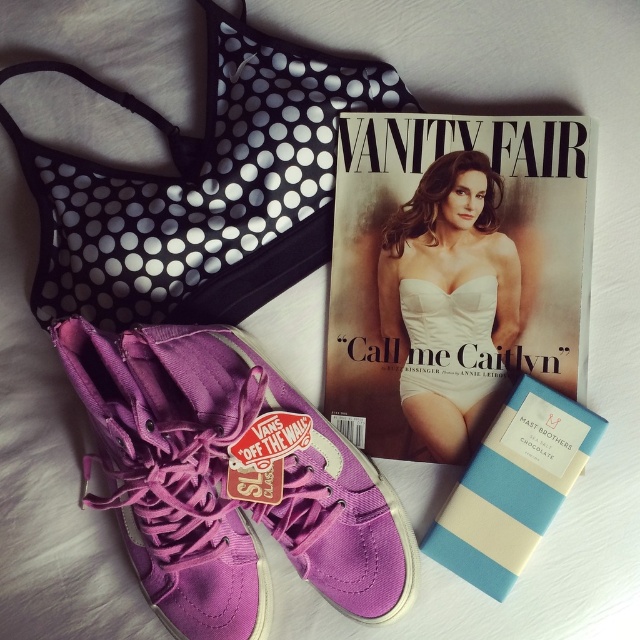
Is purple canvas shoe at center positioned in front of blue striped chocolate bar at center?

Yes, it is.

Locate an element on the screen. purple canvas shoe at center is located at coordinates (289, 467).

I want to click on purple canvas shoe at center, so click(289, 467).

Image resolution: width=640 pixels, height=640 pixels. What do you see at coordinates (200, 184) in the screenshot?
I see `black dotted bikini top at upper left` at bounding box center [200, 184].

Find the location of a particular element. black dotted bikini top at upper left is located at coordinates (200, 184).

Find the location of a particular element. This screenshot has height=640, width=640. black dotted bikini top at upper left is located at coordinates (200, 184).

Can you confirm if purple canvas shoe at center is smaller than white satin dress at center?

Incorrect, purple canvas shoe at center is not smaller in size than white satin dress at center.

Can you confirm if purple canvas shoe at center is shorter than white satin dress at center?

Yes.

This screenshot has width=640, height=640. What are the coordinates of `purple canvas shoe at center` in the screenshot? It's located at (289, 467).

At what (x,y) coordinates should I click in order to perform the action: click on purple canvas shoe at center. Please return your answer as a coordinate pair (x, y). Looking at the image, I should click on [x=289, y=467].